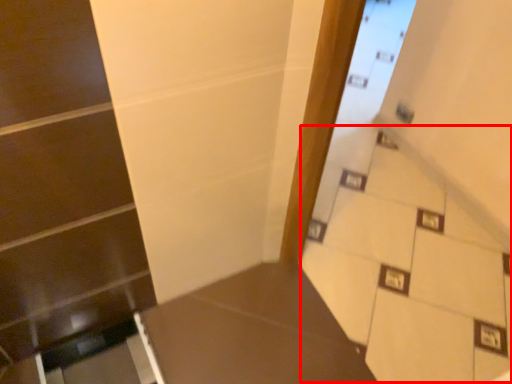
Question: Considering the relative positions of stairwell (annotated by the red box) and table in the image provided, where is stairwell (annotated by the red box) located with respect to the staircase?

Choices:
 (A) left
 (B) right

Answer: (B)